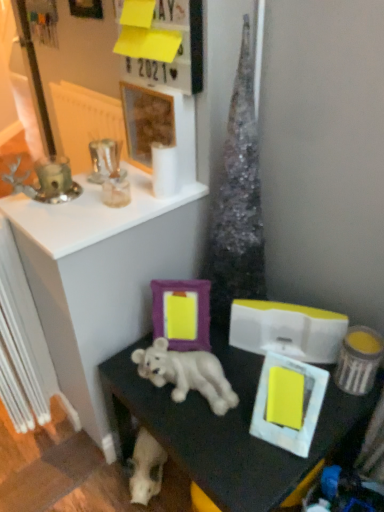
What are the coordinates of `vacant area on top of white glossy table at center (from a real-world perspective)` in the screenshot? It's located at (240, 390).